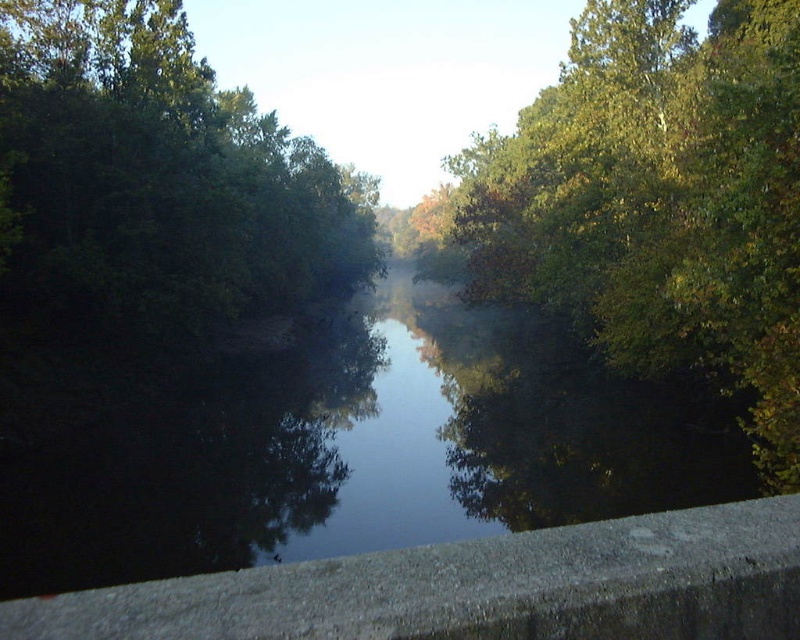
You are standing at the edge of the river and see two points in the scene. The first point is at coordinates point (x=501, y=152) and the second is at point (x=574, y=536). Which point is closer to you?

Point (x=501, y=152) is further to the camera than point (x=574, y=536), so the point closer to you is point (x=574, y=536).

You are standing at the center of the river and see a point marked at coordinates (660, 202). Which object does this point correspond to?

The point corresponds to the green leafy tree at upper right.

You are standing at the point with coordinates 0.5,0.5 in the image. You want to walk towards the dark reflective water at center. In which direction should you move?

You should move towards the point with coordinates (362, 451) to reach the dark reflective water at center.